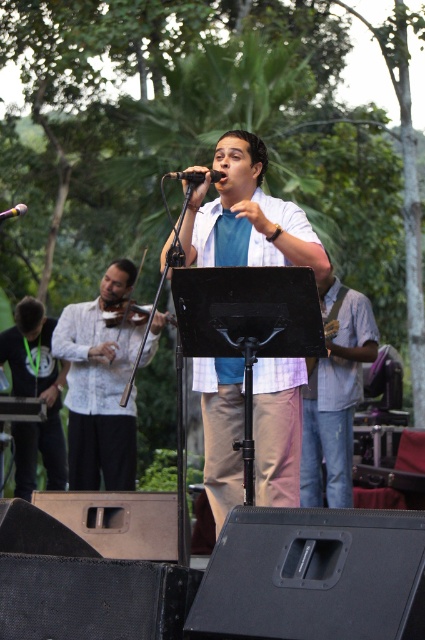
Does white textured shirt at center have a greater width compared to yellow and black plastic microphone at upper left?

In fact, white textured shirt at center might be narrower than yellow and black plastic microphone at upper left.

Does white textured shirt at center appear over yellow and black plastic microphone at upper left?

No.

Does point (84, 371) come behind point (17, 209)?

Yes, point (84, 371) is behind point (17, 209).

You are a GUI agent. You are given a task and a screenshot of the screen. Output one action in this format:
    pyautogui.click(x=<x>, y=<y>)
    Task: Click on the white textured shirt at center
    
    Given the screenshot: What is the action you would take?
    [99, 385]

From the picture: Who is higher up, white checkered shirt at center or black matte shirt at left?

Positioned higher is white checkered shirt at center.

Is white checkered shirt at center to the left of black matte shirt at left from the viewer's perspective?

No, white checkered shirt at center is not to the left of black matte shirt at left.

What do you see at coordinates (246, 216) in the screenshot? The image size is (425, 640). I see `white checkered shirt at center` at bounding box center [246, 216].

Where is `white checkered shirt at center`? The image size is (425, 640). white checkered shirt at center is located at coordinates (246, 216).

Which is in front, point (193, 172) or point (19, 211)?

Point (193, 172) is in front.

Can you confirm if black matte microphone at center is positioned to the left of yellow and black plastic microphone at upper left?

No, black matte microphone at center is not to the left of yellow and black plastic microphone at upper left.

Where is `black matte microphone at center`? black matte microphone at center is located at coordinates (187, 177).